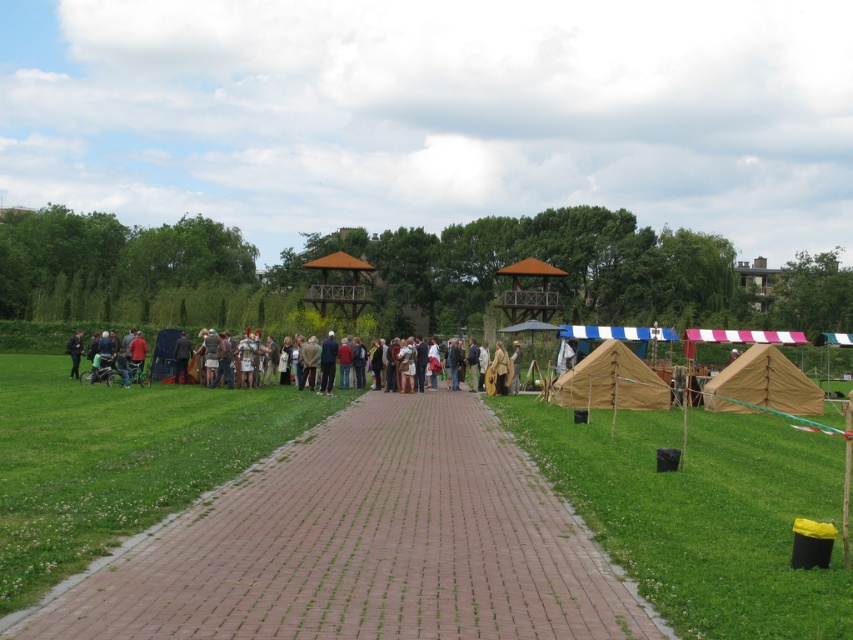
I want to click on brick paved path at center, so click(x=361, y=545).

Is brick paved path at center wider than tan canvas tent at right?

Indeed, brick paved path at center has a greater width compared to tan canvas tent at right.

Identify the location of brick paved path at center. The image size is (853, 640). (361, 545).

This screenshot has width=853, height=640. I want to click on tan canvas tent at right, so click(763, 385).

Is point (424, 632) positioned after point (653, 371)?

No, it is not.

This screenshot has width=853, height=640. I want to click on brick paved path at center, so click(361, 545).

Is point (430, 394) closer to camera compared to point (630, 355)?

No, it is not.

Identify the location of brick paved path at center. (361, 545).